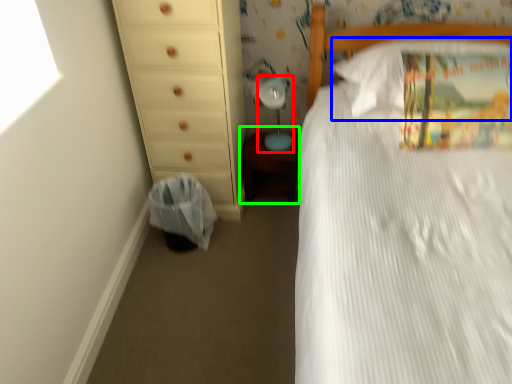
Question: Based on their relative distances, which object is farther from table lamp (highlighted by a red box)? Choose from pillow (highlighted by a blue box) and changing table (highlighted by a green box).

Choices:
 (A) pillow
 (B) changing table

Answer: (A)